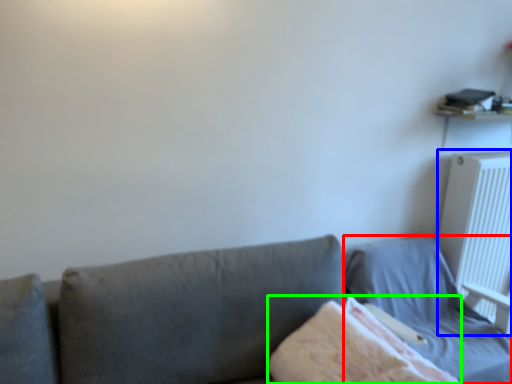
Question: Which is farther away from bed (highlighted by a red box)? radiator (highlighted by a blue box) or blanket (highlighted by a green box)?

Choices:
 (A) radiator
 (B) blanket

Answer: (B)